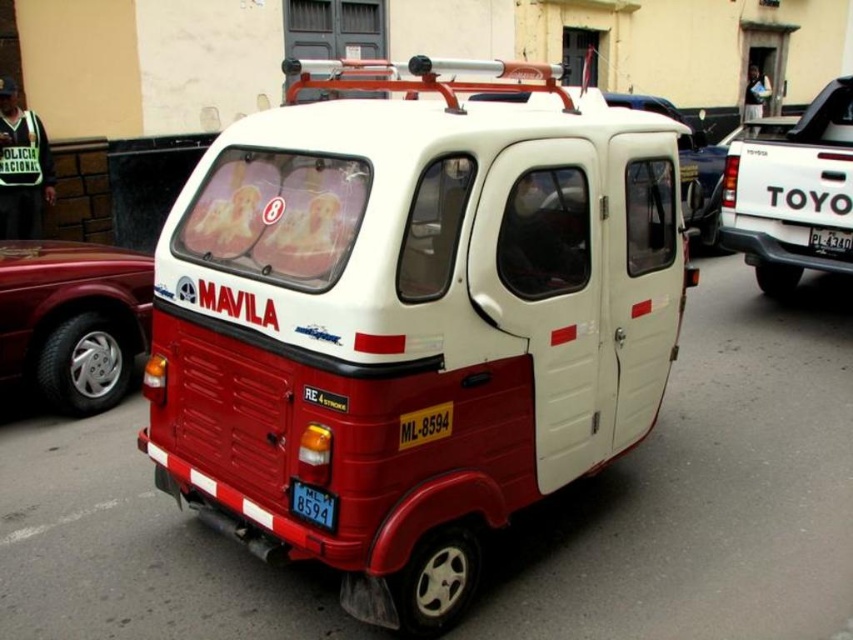
Question: Which point appears farthest from the camera in this image?

Choices:
 (A) (717, 198)
 (B) (463, 273)
 (C) (721, 218)

Answer: (A)

Question: Can you confirm if matte white and red van at center is positioned below black plastic license plate at lower center?

Choices:
 (A) no
 (B) yes

Answer: (A)

Question: Is matte white and red van at center behind black plastic license plate at center?

Choices:
 (A) no
 (B) yes

Answer: (A)

Question: Which is farther from the matte white and red van at center?

Choices:
 (A) white matte pickup truck at right
 (B) black plastic license plate at center
 (C) white matte van at center
 (D) black plastic license plate at lower center

Answer: (C)

Question: Which object is farther from the camera taking this photo?

Choices:
 (A) black plastic license plate at center
 (B) black plastic license plate at lower center
 (C) matte red car at lower left
 (D) matte white and red van at center

Answer: (A)

Question: From the image, what is the correct spatial relationship of matte white and red van at center in relation to matte red car at lower left?

Choices:
 (A) left
 (B) right

Answer: (B)